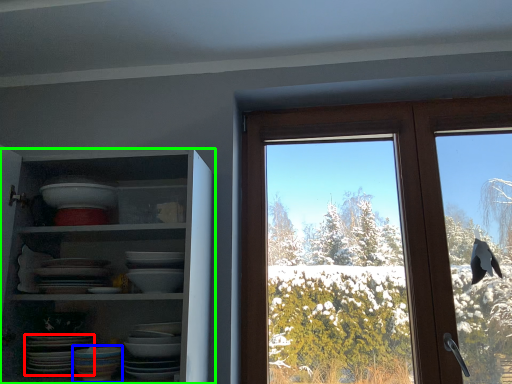
Question: Considering the real-world distances, which object is closest to platter (highlighted by a red box)? tableware (highlighted by a blue box) or shelf (highlighted by a green box).

Choices:
 (A) tableware
 (B) shelf

Answer: (A)